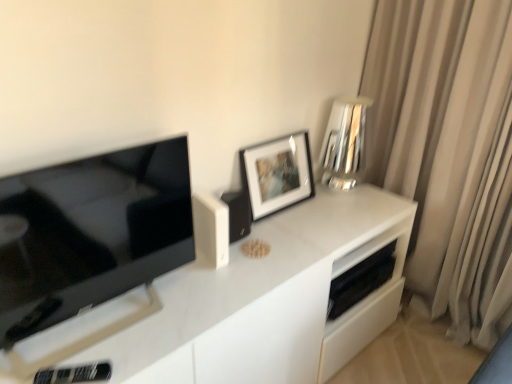
Question: Is white matte speaker at center, arranged as the 2th appliance when viewed from the left, closer to the viewer compared to black matte speaker at upper center, acting as the 3th appliance starting from the right?

Choices:
 (A) yes
 (B) no

Answer: (A)

Question: Is white matte speaker at center, arranged as the 2th appliance when viewed from the left, oriented away from black matte speaker at upper center, the third appliance in the left-to-right sequence?

Choices:
 (A) no
 (B) yes

Answer: (A)

Question: Can black matte speaker at upper center, acting as the 3th appliance starting from the right, be found inside white matte speaker at center, arranged as the 2th appliance when viewed from the left?

Choices:
 (A) yes
 (B) no

Answer: (B)

Question: Considering the relative sizes of white matte speaker at center, arranged as the 2th appliance when viewed from the left, and black matte speaker at upper center, acting as the 3th appliance starting from the right, in the image provided, is white matte speaker at center, arranged as the 2th appliance when viewed from the left, smaller than black matte speaker at upper center, acting as the 3th appliance starting from the right,?

Choices:
 (A) no
 (B) yes

Answer: (B)

Question: From a real-world perspective, is white matte speaker at center, placed as the 4th appliance when sorted from back to front, on black matte speaker at upper center, acting as the 3th appliance starting from the right?

Choices:
 (A) yes
 (B) no

Answer: (A)

Question: Looking at the image, does black matte speaker at upper center, acting as the 3th appliance starting from the right, seem bigger or smaller compared to white matte picture frame at upper center?

Choices:
 (A) big
 (B) small

Answer: (B)

Question: From the image's perspective, relative to white matte picture frame at upper center, is black matte speaker at upper center, which is counted as the 3th appliance, starting from the back, above or below?

Choices:
 (A) below
 (B) above

Answer: (A)

Question: Is black matte speaker at upper center, the third appliance in the left-to-right sequence, situated inside white matte picture frame at upper center or outside?

Choices:
 (A) inside
 (B) outside

Answer: (B)

Question: Is point click(x=230, y=205) closer or farther from the camera than point click(x=275, y=203)?

Choices:
 (A) closer
 (B) farther

Answer: (A)

Question: Does point (237, 192) appear closer or farther from the camera than point (348, 127)?

Choices:
 (A) farther
 (B) closer

Answer: (B)

Question: Based on their positions, is black matte speaker at upper center, acting as the 3th appliance starting from the right, located to the left or right of silver reflective vase at upper right, which is the fourth appliance from left to right?

Choices:
 (A) left
 (B) right

Answer: (A)

Question: From the image's perspective, relative to silver reflective vase at upper right, the 2th appliance viewed from the back, is black matte speaker at upper center, acting as the 3th appliance starting from the right, above or below?

Choices:
 (A) above
 (B) below

Answer: (B)

Question: Is black matte speaker at upper center, the third appliance in the left-to-right sequence, inside or outside of silver reflective vase at upper right, which is counted as the 4th appliance, starting from the front?

Choices:
 (A) inside
 (B) outside

Answer: (B)

Question: Is black glossy tv at left taller or shorter than black plastic remote control at lower left, the 5th appliance viewed from the right?

Choices:
 (A) tall
 (B) short

Answer: (A)

Question: Would you say black glossy tv at left is to the left or to the right of black plastic remote control at lower left, marked as the 5th appliance in a back-to-front arrangement, in the picture?

Choices:
 (A) left
 (B) right

Answer: (B)